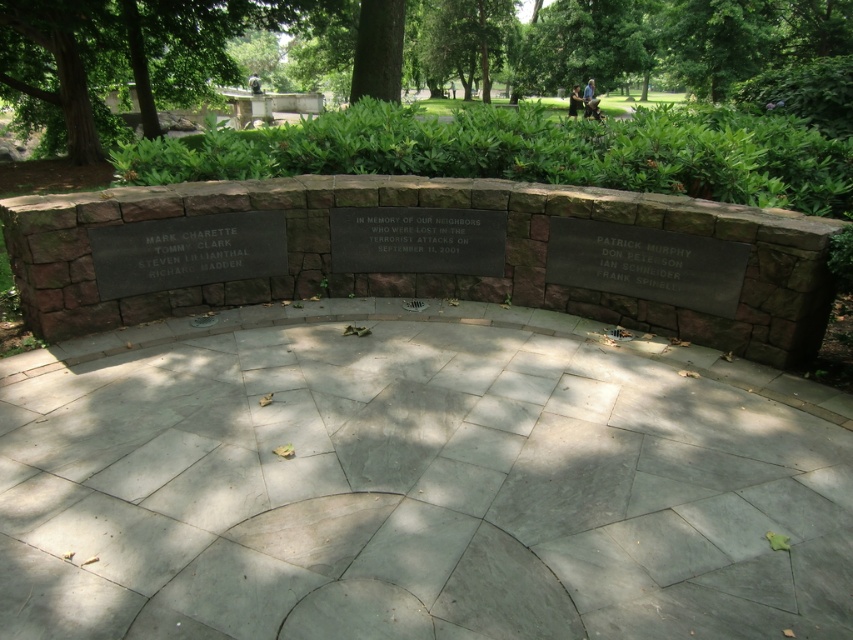
Looking at this image, does black polished stone plaque at center appear under black stone plaque at center?

Indeed, black polished stone plaque at center is positioned under black stone plaque at center.

Can you confirm if black polished stone plaque at center is taller than black stone plaque at center?

Correct, black polished stone plaque at center is much taller as black stone plaque at center.

Is point (416, 236) positioned in front of point (428, 259)?

Yes, it is.

I want to click on black polished stone plaque at center, so click(416, 241).

Is green leafy tree at upper left below black polished stone plaque at center?

No, green leafy tree at upper left is not below black polished stone plaque at center.

Which of these two, green leafy tree at upper left or black polished stone plaque at center, stands taller?

black polished stone plaque at center

Does point (54, 26) lie in front of point (370, 268)?

No.

The height and width of the screenshot is (640, 853). What are the coordinates of `green leafy tree at upper left` in the screenshot? It's located at (131, 51).

The image size is (853, 640). Describe the element at coordinates (131, 51) in the screenshot. I see `green leafy tree at upper left` at that location.

Does green leafy tree at upper left appear on the right side of black stone plaque at center?

In fact, green leafy tree at upper left is to the left of black stone plaque at center.

Locate an element on the screen. green leafy tree at upper left is located at coordinates (131, 51).